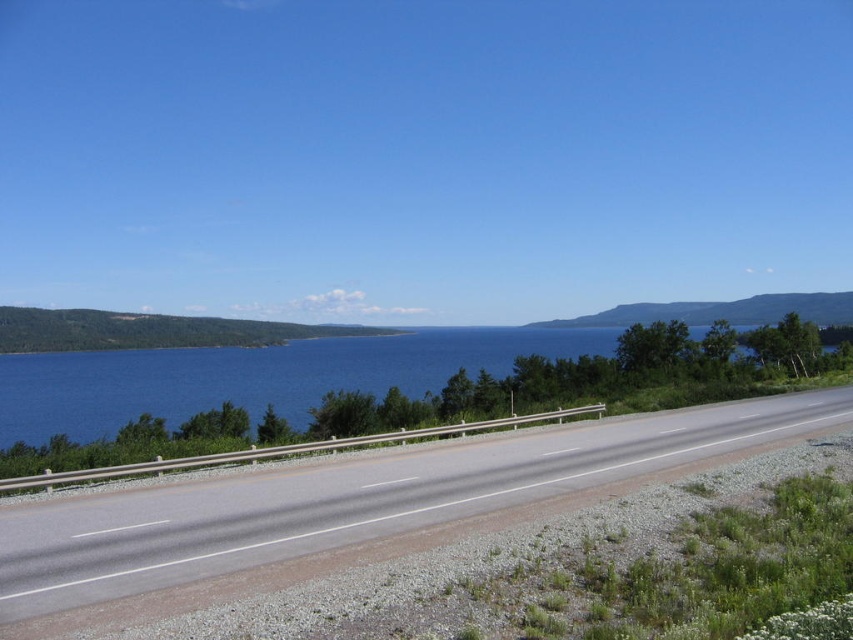
Question: Among these objects, which one is farthest from the camera?

Choices:
 (A) blue water at center
 (B) asphalt road at center

Answer: (A)

Question: Is asphalt road at center above blue water at center?

Choices:
 (A) yes
 (B) no

Answer: (B)

Question: Which point is closer to the camera?

Choices:
 (A) (57, 538)
 (B) (263, 378)

Answer: (A)

Question: Is asphalt road at center below blue water at center?

Choices:
 (A) yes
 (B) no

Answer: (A)

Question: Does asphalt road at center have a larger size compared to blue water at center?

Choices:
 (A) yes
 (B) no

Answer: (B)